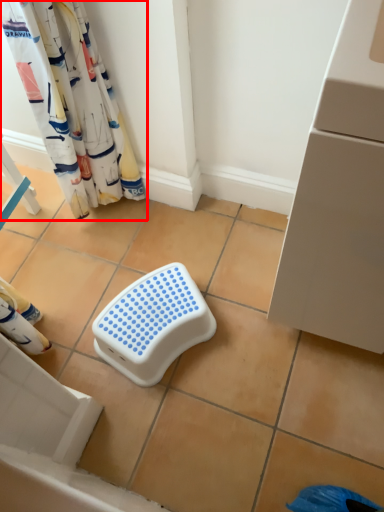
Question: From the image's perspective, where is curtain (annotated by the red box) located in relation to step stool in the image?

Choices:
 (A) above
 (B) below

Answer: (A)